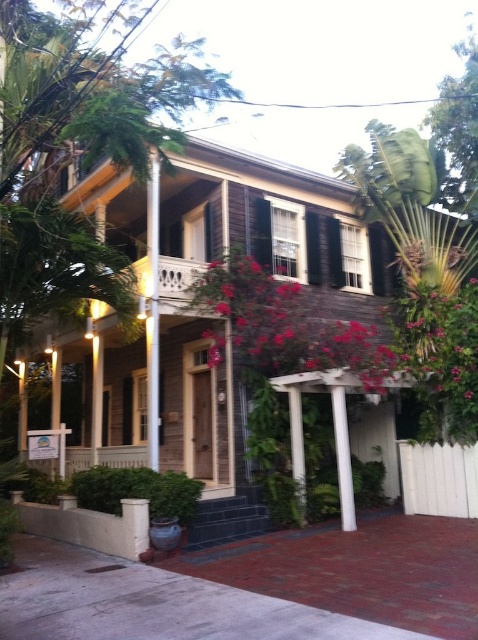
You are standing in front of the house and want to place a decorative item between the pink wood flowers at center and the white painted wood column at center. Which side of the column should you place it on to ensure it is between them?

The pink wood flowers at center is positioned on the right side of the white painted wood column at center, so placing the decorative item to the right side of the column would position it between them.

You are standing in front of the house and notice a green leafy bush at lower center and a white painted wood column at center. Which object is positioned to the left side of the other?

The green leafy bush at lower center is to the left of the white painted wood column at center.

Looking at this image, you are an architect assessing the structural integrity of the house. You notice the white smooth column at center and the white smooth pillar at lower center. Which one is more likely to support a heavier load based on their size?

The white smooth column at center is wider than the white smooth pillar at lower center, so it can support a heavier load.